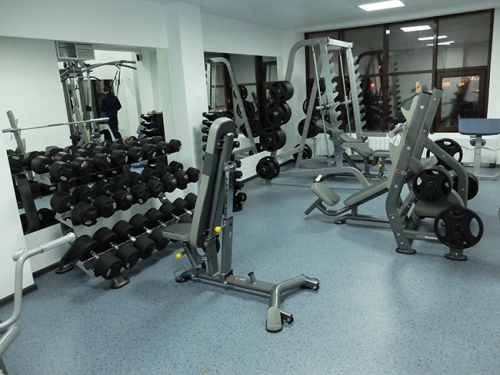
Locate an element on the screen. windows is located at coordinates (311, 62), (367, 42), (441, 42), (409, 47), (460, 89), (373, 88), (340, 93).